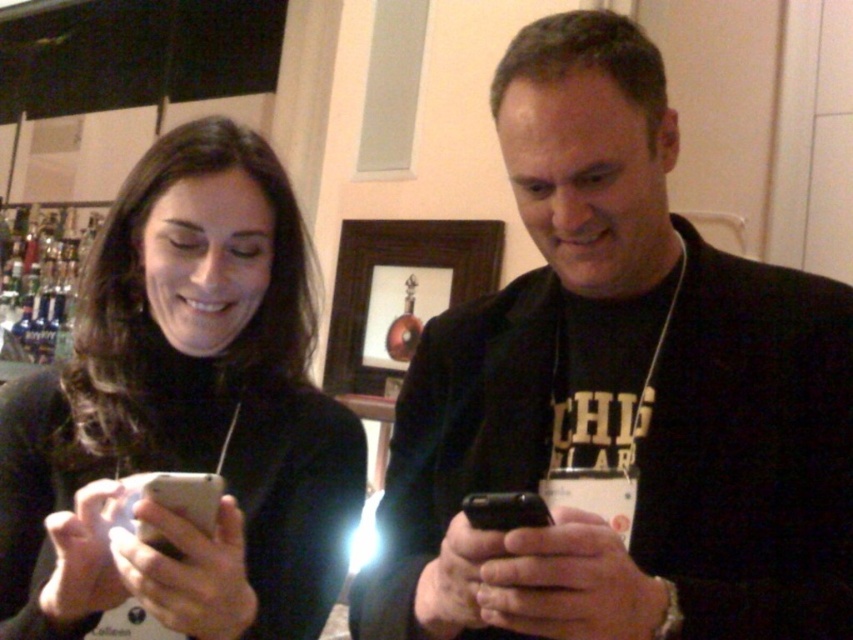
Question: Which of these objects is positioned closest to the black glossy smartphone at center?

Choices:
 (A) matte black phone at left
 (B) black matte phone at center
 (C) black fabric t-shirt at center

Answer: (C)

Question: Is matte black phone at left below black glossy smartphone at center?

Choices:
 (A) yes
 (B) no

Answer: (B)

Question: Estimate the real-world distances between objects in this image. Which object is farther from the matte black phone at left?

Choices:
 (A) black fabric t-shirt at center
 (B) black matte phone at center
 (C) black glossy smartphone at center

Answer: (A)

Question: Does matte black phone at left have a smaller size compared to black glossy smartphone at center?

Choices:
 (A) yes
 (B) no

Answer: (B)

Question: Is the position of matte black phone at left more distant than that of black fabric t-shirt at center?

Choices:
 (A) no
 (B) yes

Answer: (A)

Question: Which object is closer to the camera taking this photo?

Choices:
 (A) black matte phone at center
 (B) black fabric t-shirt at center
 (C) black glossy smartphone at center
 (D) matte black phone at left

Answer: (C)